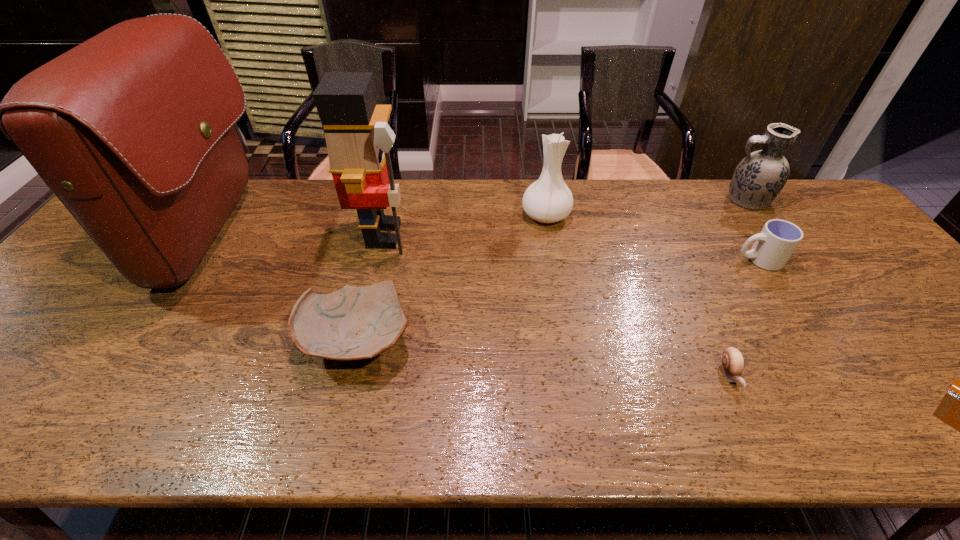
In order to click on nutcracker that is at the far edge in this screenshot , I will do `click(358, 138)`.

At what (x,y) coordinates should I click in order to perform the action: click on vacant area at the far edge. Please return your answer as a coordinate pair (x, y). Image resolution: width=960 pixels, height=540 pixels. Looking at the image, I should click on (x=720, y=204).

What are the coordinates of `free space at the near edge` in the screenshot? It's located at (279, 426).

Find the location of a particular element. Image resolution: width=960 pixels, height=540 pixels. vacant region at the right edge is located at coordinates (876, 315).

At what (x,y) coordinates should I click in order to perform the action: click on free space at the far right corner of the desktop. Please return your answer as a coordinate pair (x, y). This screenshot has width=960, height=540. Looking at the image, I should click on (x=811, y=202).

Where is `vacant space that's between the left vase and the pottery`? This screenshot has width=960, height=540. vacant space that's between the left vase and the pottery is located at coordinates (452, 278).

In order to click on unoccupied area between the satchel and the cup in this screenshot , I will do `click(486, 248)`.

You are a GUI agent. You are given a task and a screenshot of the screen. Output one action in this format:
    pyautogui.click(x=<x>, y=<y>)
    Task: Click on the free space between the pottery and the cup
    The image size is (960, 540).
    Given the screenshot: What is the action you would take?
    pyautogui.click(x=559, y=300)

Image resolution: width=960 pixels, height=540 pixels. In order to click on empty location between the cup and the nutcracker in this screenshot , I will do `click(571, 247)`.

In order to click on free spot between the cup and the pottery in this screenshot , I will do [x=559, y=300].